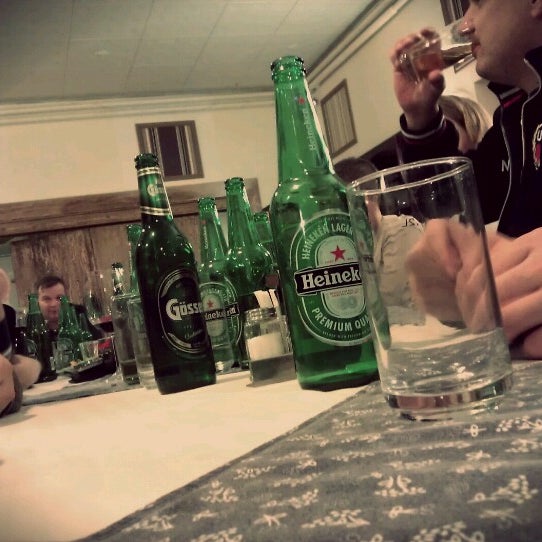
You are a GUI agent. You are given a task and a screenshot of the screen. Output one action in this format:
    pyautogui.click(x=<x>, y=<y>)
    Task: Click on the placemat
    The image size is (542, 542).
    Given the screenshot: What is the action you would take?
    pyautogui.click(x=327, y=451)